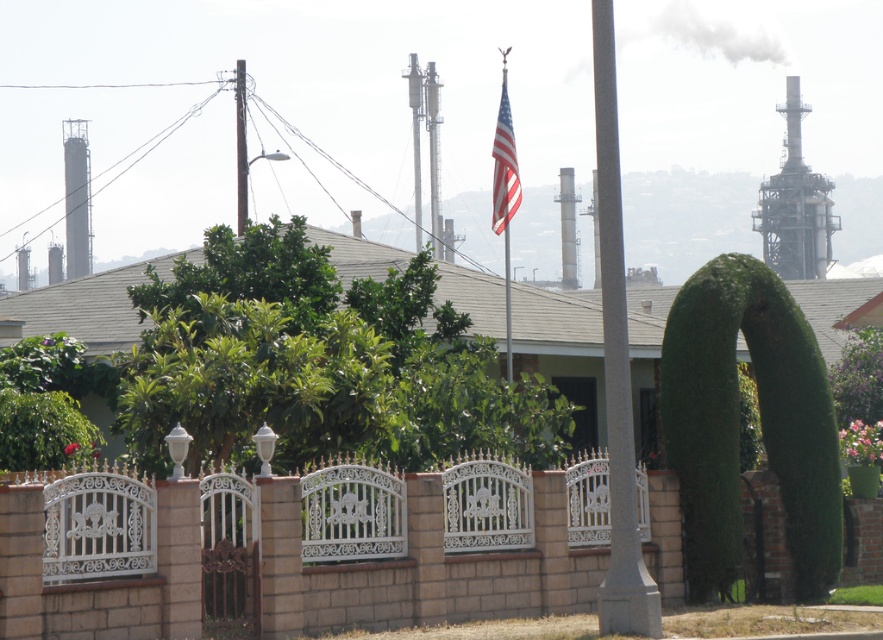
You are standing at the entrance of the house and want to place a new garden statue exactly 0.5 meters to the right of the metallic silver flag pole at center. According to the image, where should you place the statue?

The metallic silver flag pole at center is located at point (504, 193). To place the statue 0.5 meters to the right, you would position it at the coordinates 0.303 plus 0.5 meters in the x direction, maintaining the same y coordinate.

You are standing in the residential area and want to take a photo of the american flag at center and the metallic streetlight at upper center. Which object should you focus on first to ensure it appears larger in your photo?

The american flag at center should be focused on first because it is closer to the viewer than the metallic streetlight at upper center, making it appear larger when in focus.

You are standing in the residential area and want to locate the metallic silver flag pole at center. Which direction should you look relative to the metallic pole at upper center?

The metallic silver flag pole at center is to the right of the metallic pole at upper center, so you should look to the right side of the metallic pole at upper center to locate it.